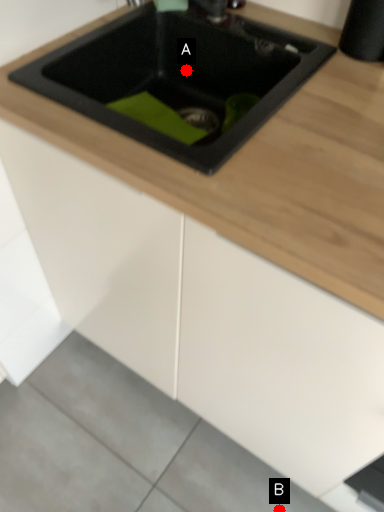
Question: Two points are circled on the image, labeled by A and B beside each circle. Which point appears farthest from the camera in this image?

Choices:
 (A) A is further
 (B) B is further

Answer: (B)